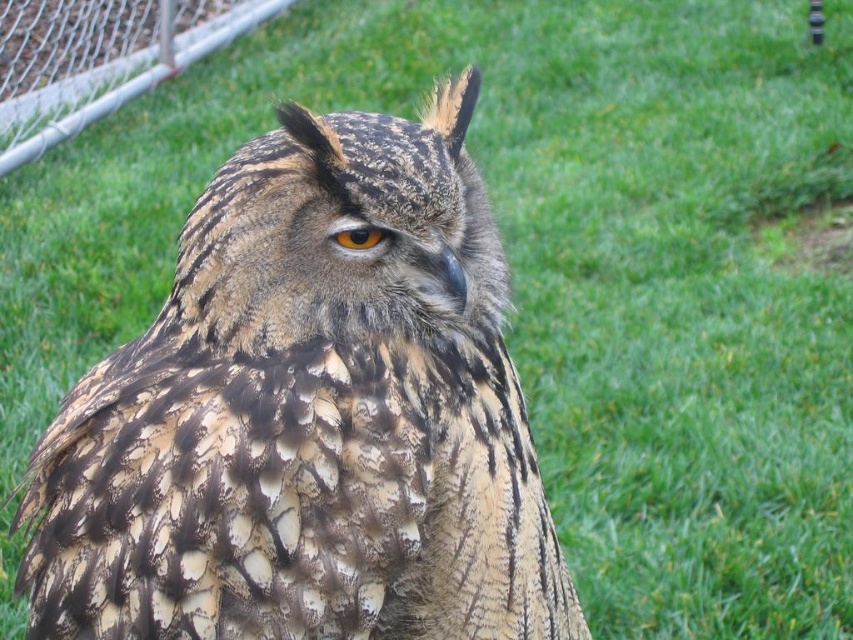
You are a wildlife photographer trying to capture the perfect shot of the camouflage feathered owl at center. Your camera has a focus point at coordinate 0.650, 0.362. Is this focus point likely to be on the owl?

Yes, the camouflage feathered owl at center is located at point [308,416], so the focus point is exactly on the owl.

You are a photographer standing 2 meters away from the owl. You want to take a photo of the owl and include the brushed metal fence at upper left in the frame. Is the fence within your camera lens focal length if your camera has a focal length of 50mm and you are using a full frame sensor?

The brushed metal fence at upper left is 4.58 meters away from the camera. Since the photographer is 2 meters away from the owl, the total distance from the camera to the fence would be more than 4.58 meters. However, the fence is already within the camera lens range because a 50mm focal length on a full frame sensor can capture objects up to several meters away within the frame, so yes, the fence is within the focal length.

You are a zookeeper trying to locate the brushed metal fence at upper left in the image. What are its coordinates?

The brushed metal fence at upper left is located at coordinates point [99,60].